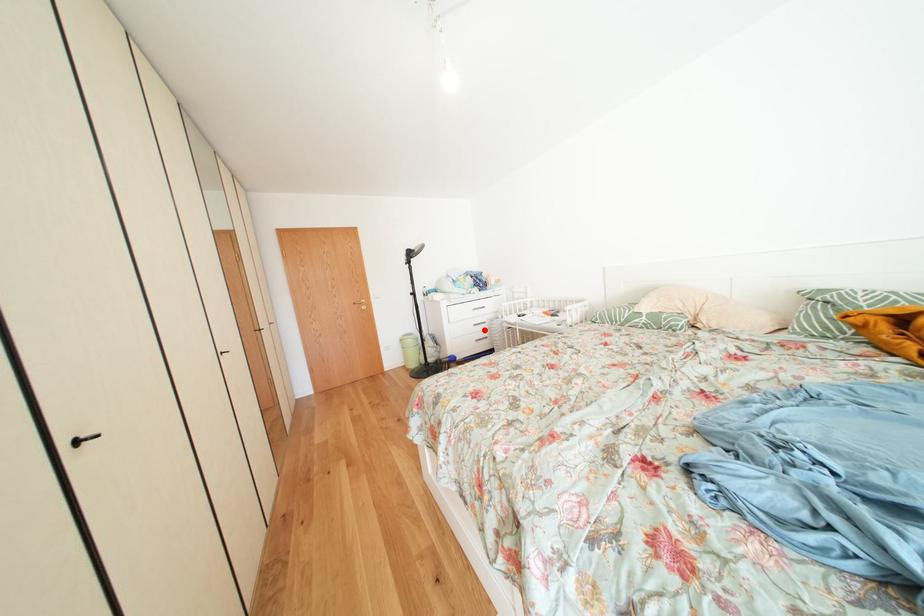
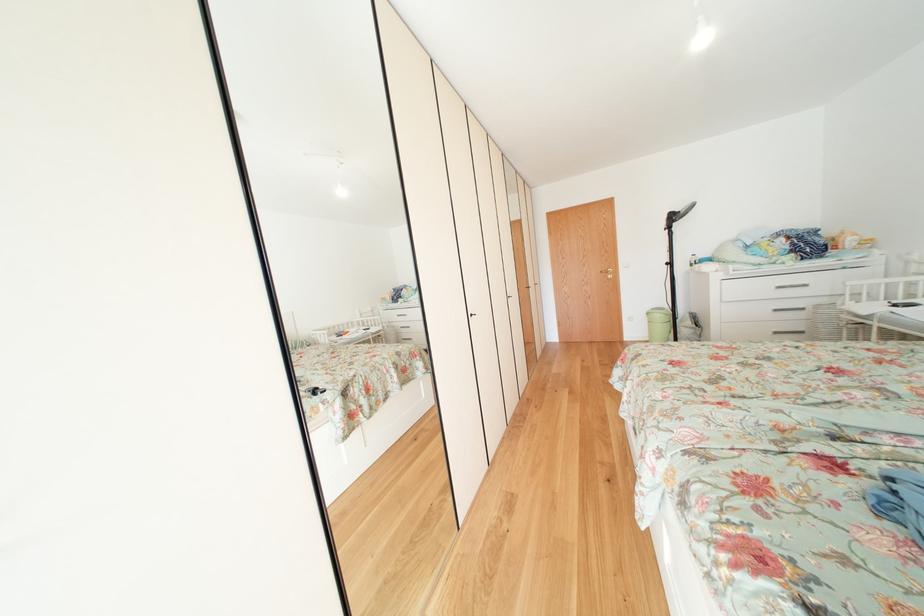
The point at the highlighted location is marked in the first image. Where is the corresponding point in the second image?

(784, 315)